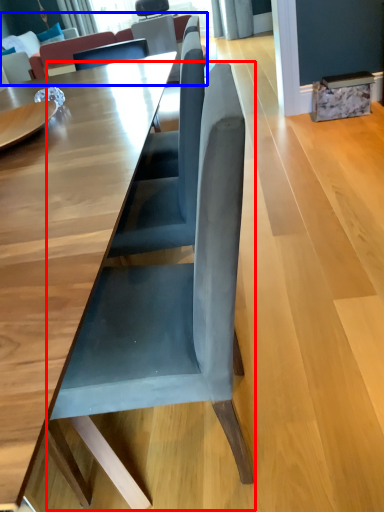
Question: Which of the following is the closest to the observer, chair (highlighted by a red box) or couch (highlighted by a blue box)?

Choices:
 (A) chair
 (B) couch

Answer: (A)